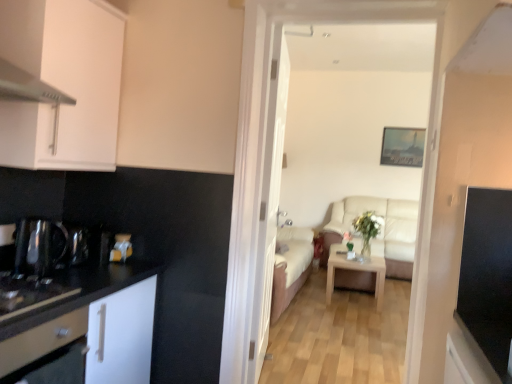
Image resolution: width=512 pixels, height=384 pixels. Identify the location of vacant area to the right of shiny metallic kettle at left, the 1th appliance when ordered from left to right. (69, 278).